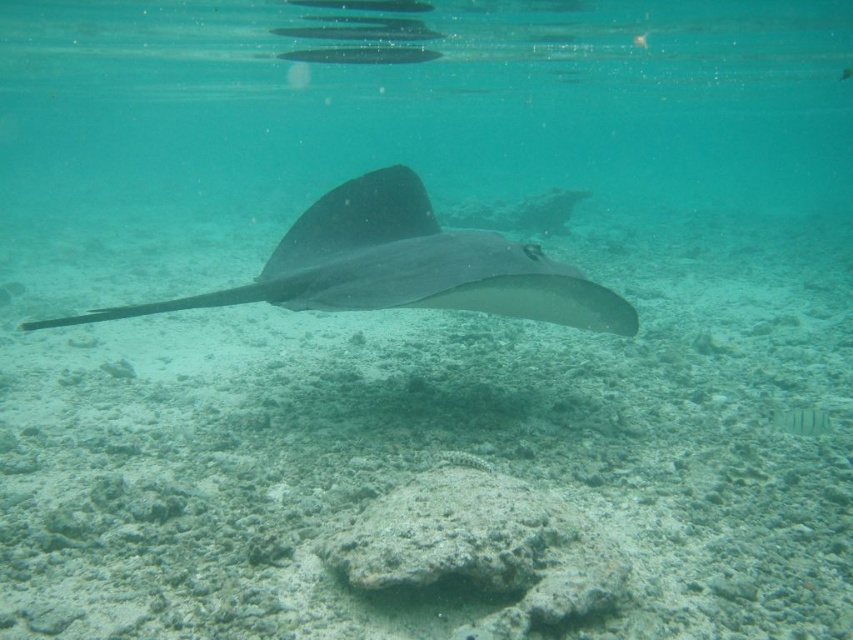
Question: Can you confirm if smooth gray stingray at center is wider than greenish-blue glossy fish at center?

Choices:
 (A) no
 (B) yes

Answer: (B)

Question: Which object appears farthest from the camera in this image?

Choices:
 (A) greenish-blue glossy fish at center
 (B) smooth gray stingray at center

Answer: (A)

Question: Can you confirm if smooth gray stingray at center is positioned to the left of greenish-blue glossy fish at center?

Choices:
 (A) yes
 (B) no

Answer: (A)

Question: Does smooth gray stingray at center have a smaller size compared to greenish-blue glossy fish at center?

Choices:
 (A) yes
 (B) no

Answer: (B)